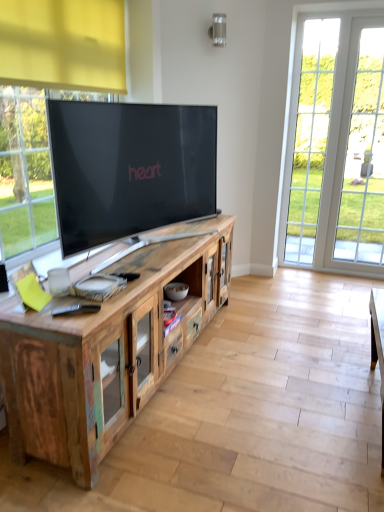
This screenshot has height=512, width=384. Describe the element at coordinates (108, 348) in the screenshot. I see `rustic wood cabinet at center` at that location.

In order to click on rustic wood cabinet at center in this screenshot , I will do `click(108, 348)`.

The image size is (384, 512). What do you see at coordinates (336, 146) in the screenshot?
I see `white glass door at right` at bounding box center [336, 146].

Locate an element on the screen. The width and height of the screenshot is (384, 512). white glass door at right is located at coordinates (336, 146).

The height and width of the screenshot is (512, 384). Identify the location of rustic wood cabinet at center. (108, 348).

Considering the relative positions of white glass door at right and rustic wood cabinet at center in the image provided, is white glass door at right to the right of rustic wood cabinet at center from the viewer's perspective?

Indeed, white glass door at right is positioned on the right side of rustic wood cabinet at center.

Which object is more forward, white glass door at right or rustic wood cabinet at center?

rustic wood cabinet at center is closer to the camera.

Between point (315, 125) and point (97, 371), which one is positioned behind?

The point (315, 125) is farther from the camera.

From the image's perspective, which object appears higher, white glass door at right or rustic wood cabinet at center?

white glass door at right, from the image's perspective.

From the picture: From a real-world perspective, is white glass door at right positioned over rustic wood cabinet at center based on gravity?

Yes, from a real-world perspective, white glass door at right is above rustic wood cabinet at center.

Considering the sizes of objects white glass door at right and rustic wood cabinet at center in the image provided, who is thinner, white glass door at right or rustic wood cabinet at center?

white glass door at right.

Considering the sizes of objects white glass door at right and rustic wood cabinet at center in the image provided, who is taller, white glass door at right or rustic wood cabinet at center?

Standing taller between the two is white glass door at right.

In the scene shown: Which of these two, white glass door at right or rustic wood cabinet at center, is smaller?

With smaller size is white glass door at right.

Can rustic wood cabinet at center be found inside white glass door at right?

No, rustic wood cabinet at center is not a part of white glass door at right.

Is white glass door at right far from rustic wood cabinet at center?

Yes.

Could you tell me if white glass door at right is turned towards rustic wood cabinet at center?

No, white glass door at right is not turned towards rustic wood cabinet at center.

Can you tell me how much white glass door at right and rustic wood cabinet at center differ in facing direction?

The facing directions of white glass door at right and rustic wood cabinet at center are 88.9 degrees apart.

The width and height of the screenshot is (384, 512). I want to click on window that appears behind the rustic wood cabinet at center, so click(x=336, y=146).

Based on their positions, is rustic wood cabinet at center located to the left or right of white glass door at right?

Based on their positions, rustic wood cabinet at center is located to the left of white glass door at right.

Between rustic wood cabinet at center and white glass door at right, which one is positioned in front?

rustic wood cabinet at center is closer to the camera.

Considering the positions of points (17, 375) and (322, 28), is point (17, 375) farther from camera compared to point (322, 28)?

That is False.

From the image's perspective, would you say rustic wood cabinet at center is shown under white glass door at right?

Indeed, from the image's perspective, rustic wood cabinet at center is shown beneath white glass door at right.

From a real-world perspective, who is located lower, rustic wood cabinet at center or white glass door at right?

In real-world perspective, rustic wood cabinet at center is lower.

Can you confirm if rustic wood cabinet at center is thinner than white glass door at right?

Incorrect, the width of rustic wood cabinet at center is not less than that of white glass door at right.

Does rustic wood cabinet at center have a lesser height compared to white glass door at right?

Correct, rustic wood cabinet at center is not as tall as white glass door at right.

Is rustic wood cabinet at center bigger or smaller than white glass door at right?

rustic wood cabinet at center is bigger than white glass door at right.

Does rustic wood cabinet at center contain white glass door at right?

That's incorrect, white glass door at right is not inside rustic wood cabinet at center.

Are rustic wood cabinet at center and white glass door at right making contact?

No, rustic wood cabinet at center is not touching white glass door at right.

Based on the photo, is rustic wood cabinet at center oriented towards white glass door at right?

No.

Where is `cabinetry located underneath the white glass door at right (from a real-world perspective)`? This screenshot has width=384, height=512. cabinetry located underneath the white glass door at right (from a real-world perspective) is located at coordinates (108, 348).

Where is `cabinetry on the left of the white glass door at right`? cabinetry on the left of the white glass door at right is located at coordinates (108, 348).

Identify the location of cabinetry below the white glass door at right (from the image's perspective). (108, 348).